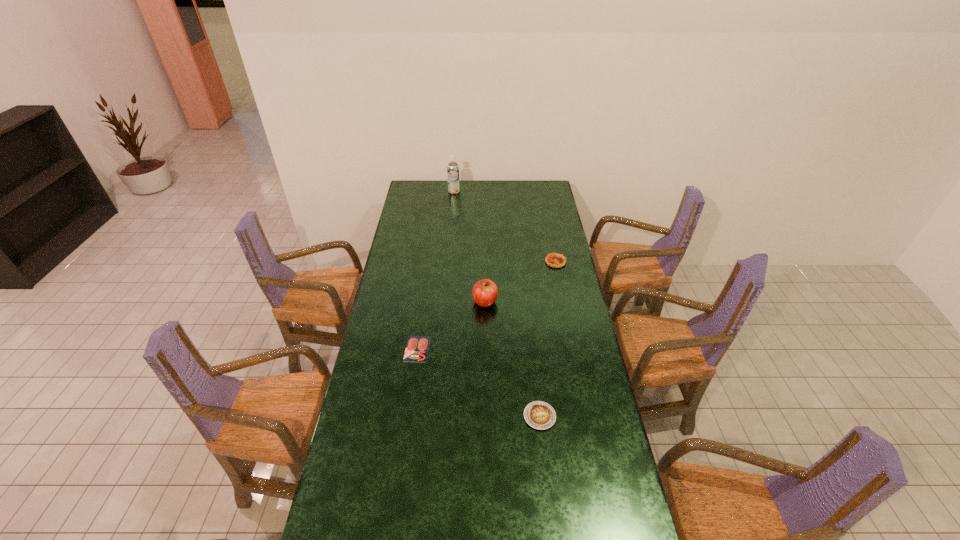
Locate an element on the screen. This screenshot has width=960, height=540. free space between the salami and the third object from right to left is located at coordinates (451, 325).

Select which object is the closest to the shortest object. Please provide its 2D coordinates. Your answer should be formatted as a tuple, i.e. [(x, y)], where the tuple contains the x and y coordinates of a point satisfying the conditions above.

[(484, 292)]

I want to click on object that is the second closest to the left quiche, so click(484, 292).

You are a GUI agent. You are given a task and a screenshot of the screen. Output one action in this format:
    pyautogui.click(x=<x>, y=<y>)
    Task: Click on the free spot that satisfies the following two spatial constraints: 1. on the label of the farther quiche; 2. on the left side of the tallest object
    
    Given the screenshot: What is the action you would take?
    pyautogui.click(x=448, y=262)

I want to click on vacant space that satisfies the following two spatial constraints: 1. on the label of the third farthest object; 2. on the right side of the soya milk, so click(x=444, y=302).

At what (x,y) coordinates should I click in order to perform the action: click on vacant space that satisfies the following two spatial constraints: 1. on the back side of the second object from right to left; 2. on the left side of the rightmost object. Please return your answer as a coordinate pair (x, y). The image size is (960, 540). Looking at the image, I should click on (522, 262).